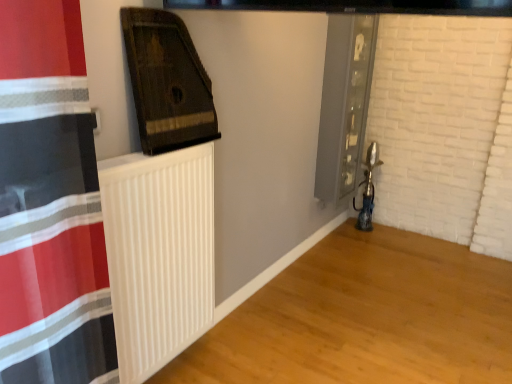
The width and height of the screenshot is (512, 384). What are the coordinates of `free space above white ribbed radiator at center (from a real-world perspective)` in the screenshot? It's located at (151, 153).